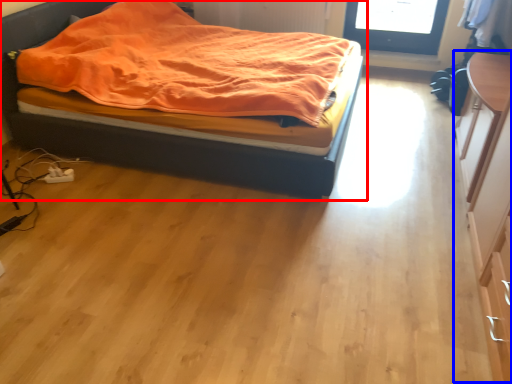
Question: Which of the following is the farthest to the observer, bed (highlighted by a red box) or dresser (highlighted by a blue box)?

Choices:
 (A) bed
 (B) dresser

Answer: (A)